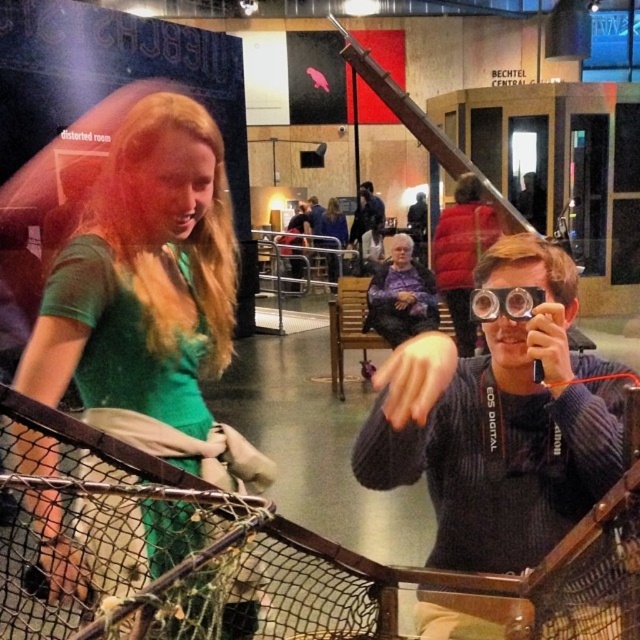
Question: Which object is closer to the camera taking this photo?

Choices:
 (A) matte green sweater at center
 (B) green matte shirt at center

Answer: (B)

Question: Which object is positioned farthest from the transparent plastic goggles at center?

Choices:
 (A) matte green sweater at center
 (B) green matte shirt at center

Answer: (A)

Question: Which object appears closest to the camera in this image?

Choices:
 (A) transparent plastic goggles at center
 (B) matte green sweater at center

Answer: (A)

Question: Is knitted sweater at center wider than transparent plastic goggles at center?

Choices:
 (A) yes
 (B) no

Answer: (A)

Question: Is green matte shirt at center wider than transparent plastic goggles at center?

Choices:
 (A) no
 (B) yes

Answer: (B)

Question: Is green matte shirt at center below transparent plastic goggles at center?

Choices:
 (A) no
 (B) yes

Answer: (B)